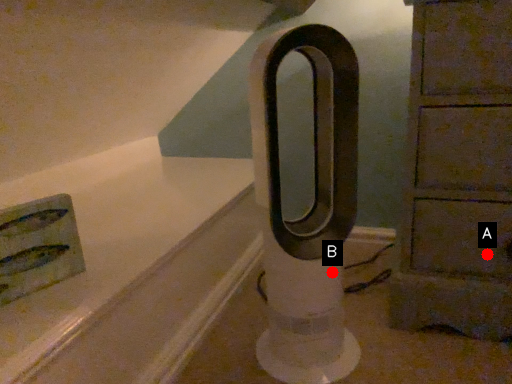
Question: Two points are circled on the image, labeled by A and B beside each circle. Which point appears farthest from the camera in this image?

Choices:
 (A) A is further
 (B) B is further

Answer: (A)